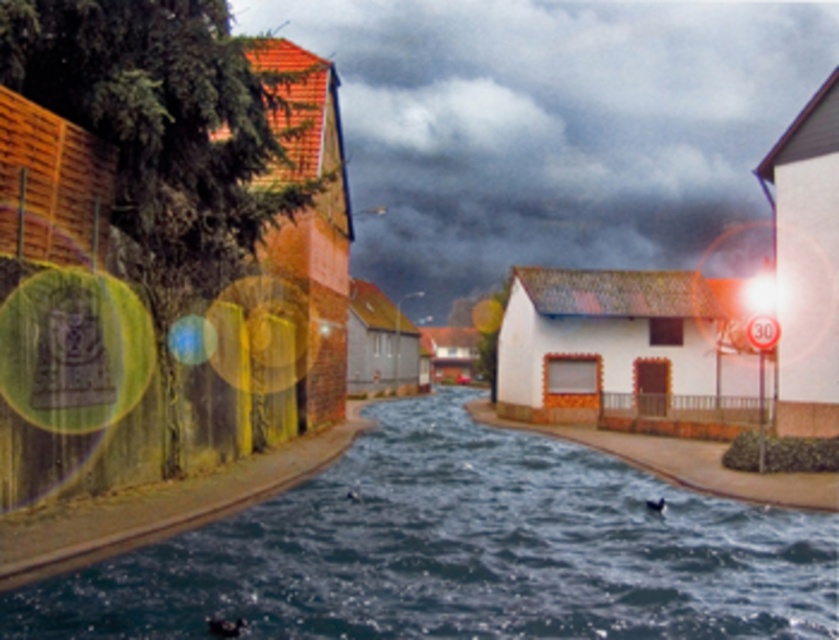
Question: Which of the following is the farthest from the observer?

Choices:
 (A) dark cloudy sky at upper center
 (B) dark blue liquid at center

Answer: (A)

Question: Among these points, which one is nearest to the camera?

Choices:
 (A) (624, 36)
 (B) (563, 618)

Answer: (B)

Question: Is dark cloudy sky at upper center positioned in front of dark blue liquid at center?

Choices:
 (A) yes
 (B) no

Answer: (B)

Question: Is dark cloudy sky at upper center above dark blue liquid at center?

Choices:
 (A) no
 (B) yes

Answer: (B)

Question: Is dark cloudy sky at upper center closer to the viewer compared to dark blue liquid at center?

Choices:
 (A) no
 (B) yes

Answer: (A)